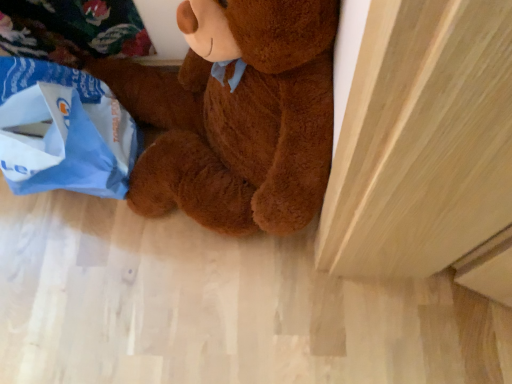
Question: Based on their sizes in the image, would you say brown plush teddy bear at center is bigger or smaller than blue paper grocery bag at lower left?

Choices:
 (A) big
 (B) small

Answer: (A)

Question: In terms of width, does brown plush teddy bear at center look wider or thinner when compared to blue paper grocery bag at lower left?

Choices:
 (A) wide
 (B) thin

Answer: (A)

Question: Is brown plush teddy bear at center taller or shorter than blue paper grocery bag at lower left?

Choices:
 (A) short
 (B) tall

Answer: (B)

Question: Considering the positions of blue paper grocery bag at lower left and brown plush teddy bear at center in the image, is blue paper grocery bag at lower left wider or thinner than brown plush teddy bear at center?

Choices:
 (A) thin
 (B) wide

Answer: (A)

Question: Would you say blue paper grocery bag at lower left is inside or outside brown plush teddy bear at center?

Choices:
 (A) outside
 (B) inside

Answer: (A)

Question: Is blue paper grocery bag at lower left in front of or behind brown plush teddy bear at center in the image?

Choices:
 (A) front
 (B) behind

Answer: (B)

Question: From a real-world perspective, relative to brown plush teddy bear at center, is blue paper grocery bag at lower left vertically above or below?

Choices:
 (A) below
 (B) above

Answer: (A)